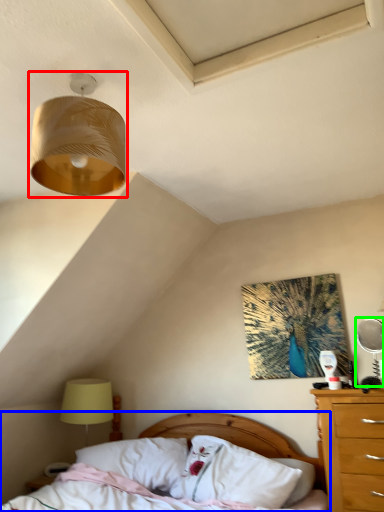
Question: Which object is the farthest from lamp (highlighted by a red box)? Choose among these: bed (highlighted by a blue box) or mechanical fan (highlighted by a green box).

Choices:
 (A) bed
 (B) mechanical fan

Answer: (A)